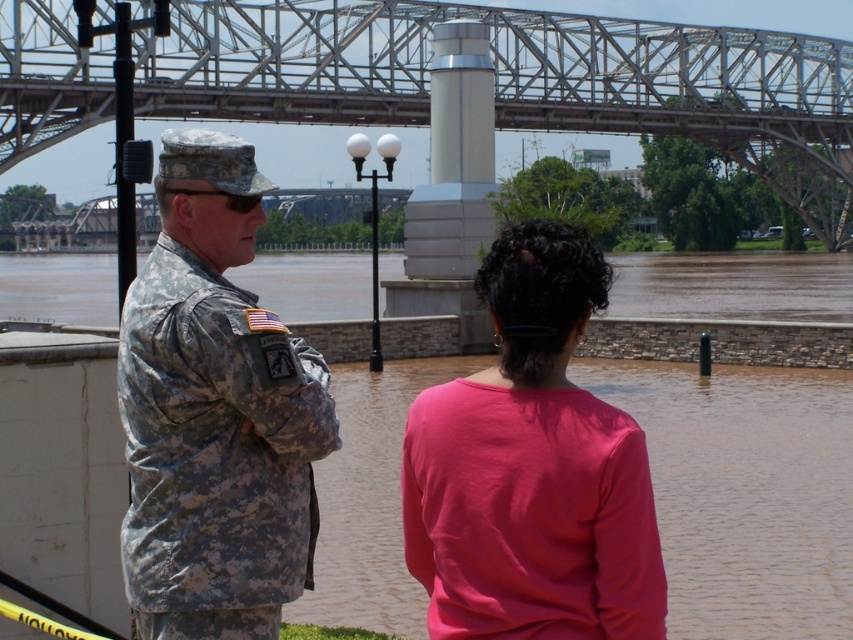
Question: Which object is positioned closest to the metallic steel bridge at upper center?

Choices:
 (A) pink matte shirt at center
 (B) camouflage uniform at left

Answer: (B)

Question: Can you confirm if metallic steel bridge at upper center is bigger than camouflage uniform at center?

Choices:
 (A) yes
 (B) no

Answer: (A)

Question: Which point is farther to the camera?

Choices:
 (A) (729, 144)
 (B) (483, 278)

Answer: (A)

Question: Does camouflage uniform at left have a larger size compared to pink matte shirt at center?

Choices:
 (A) yes
 (B) no

Answer: (A)

Question: Which of the following is the closest to the observer?

Choices:
 (A) (440, 483)
 (B) (447, 486)
 (C) (318, 362)
 (D) (793, 170)

Answer: (B)

Question: Does metallic steel bridge at upper center appear under camouflage uniform at center?

Choices:
 (A) yes
 (B) no

Answer: (B)